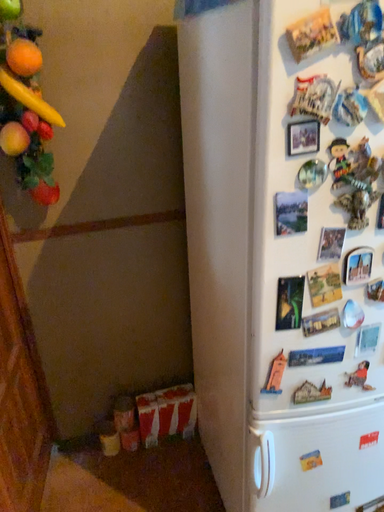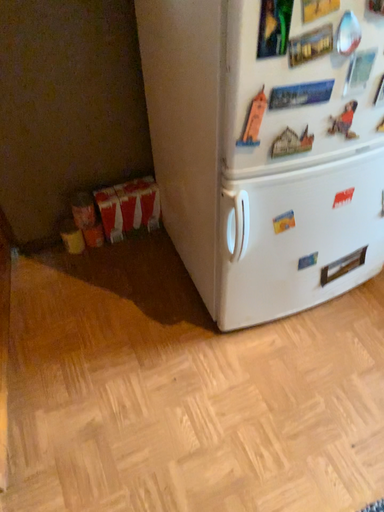
Question: How did the camera likely rotate when shooting the video?

Choices:
 (A) rotated downward
 (B) rotated upward

Answer: (A)